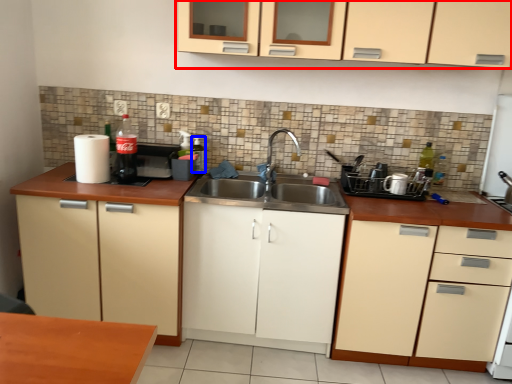
Question: Which object appears closest to the camera in this image, cabinetry (highlighted by a red box) or bottle (highlighted by a blue box)?

Choices:
 (A) cabinetry
 (B) bottle

Answer: (A)